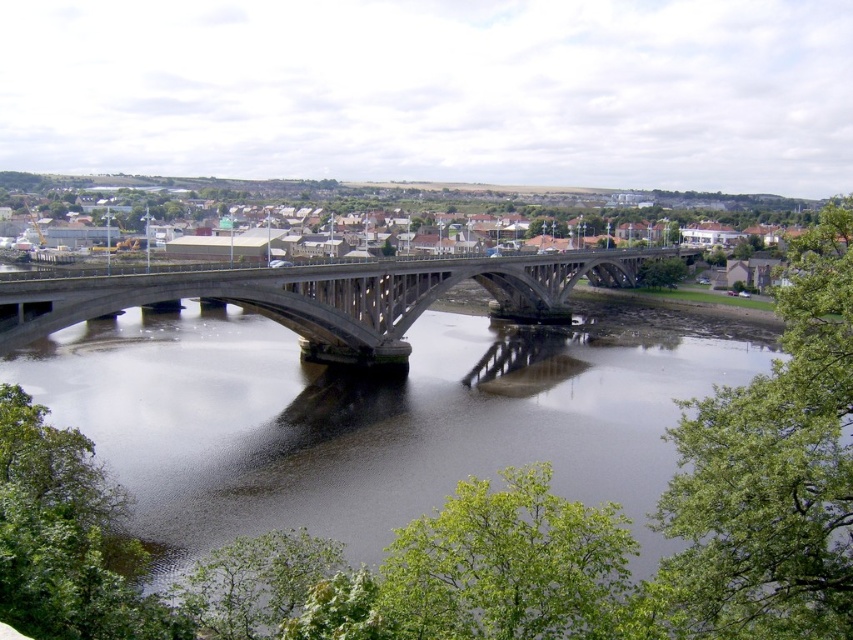
You are standing on the bridge looking down at the river. You notice two points marked on the bridge deck. The first point is at coordinates point (517, 422) and the second point is at point (627, 268). Which point is closer to you?

Point (517, 422) is closer to the camera than point (627, 268), so the first point is closer to you.